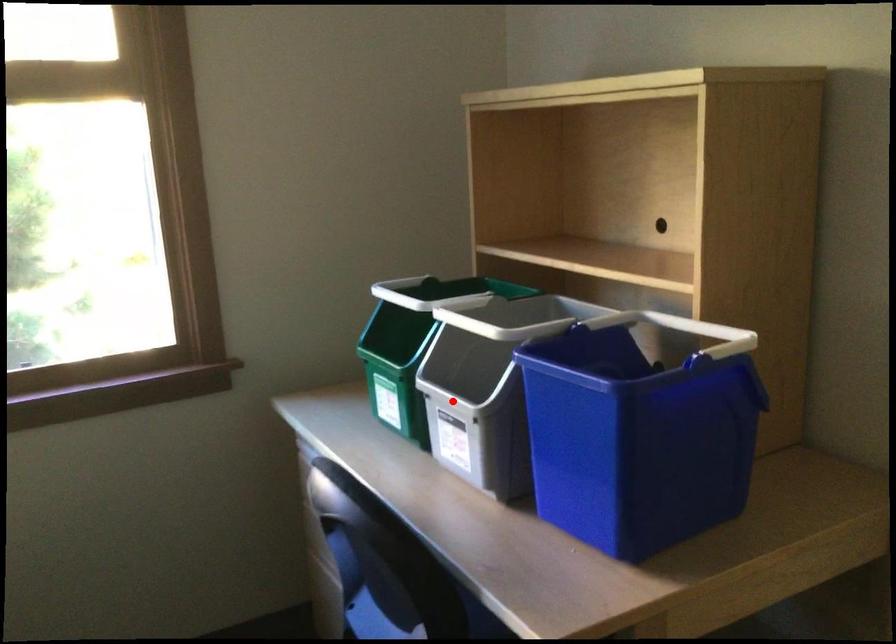
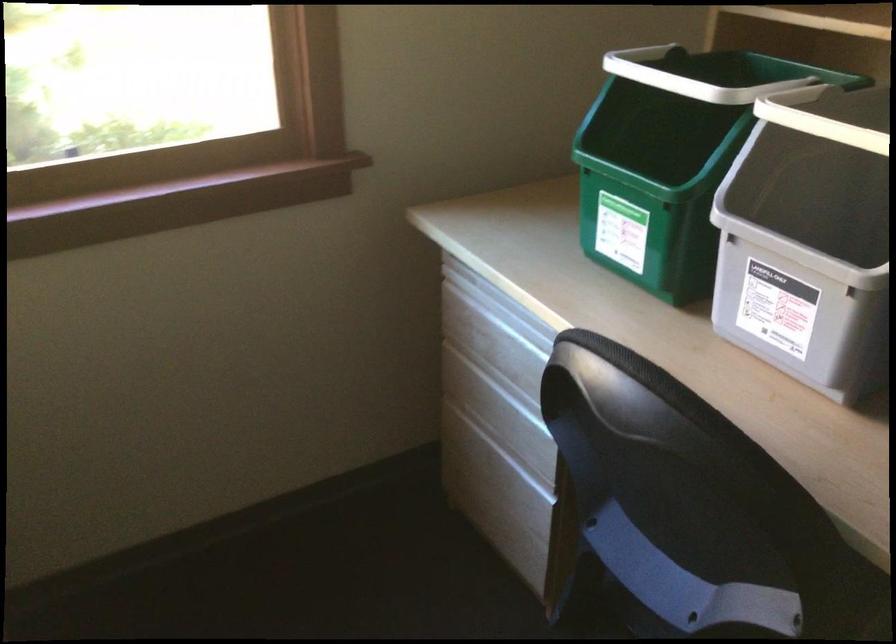
The point at the highlighted location is marked in the first image. Where is the corresponding point in the second image?

(797, 250)